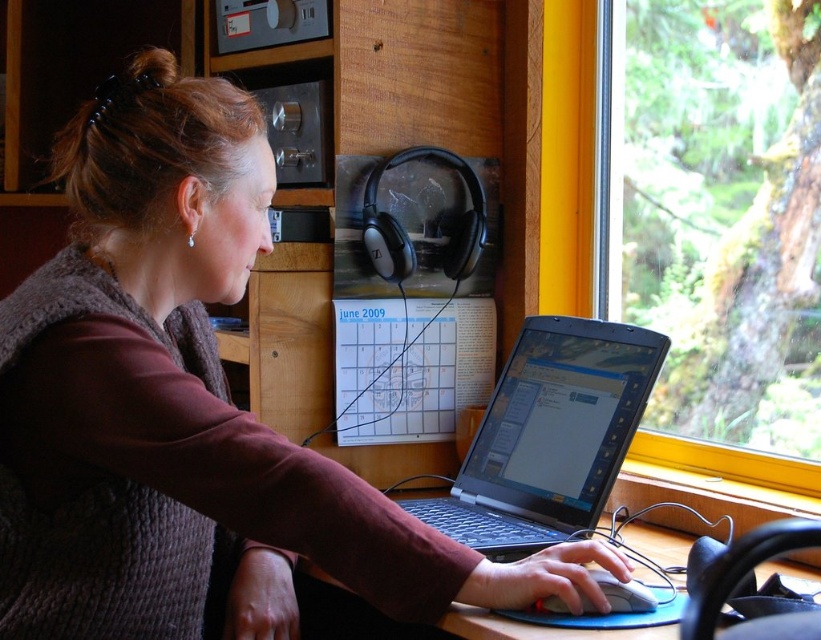
Looking at this image, you are organizing items on the desk and need to place the matte brown sweater at center and the transparent glass window at upper right. Which object is positioned lower in the scene?

The matte brown sweater at center is positioned below the transparent glass window at upper right, so it is lower in the scene.

You need to place a new keyboard that is 15 cm wide on the desk. Considering the black plastic laptop at center and the white plastic mouse at lower center, which object should you move to make space?

The black plastic laptop at center is wider than the white plastic mouse at lower center, so moving the white plastic mouse at lower center would require less space and be easier to relocate to make room for the new keyboard.